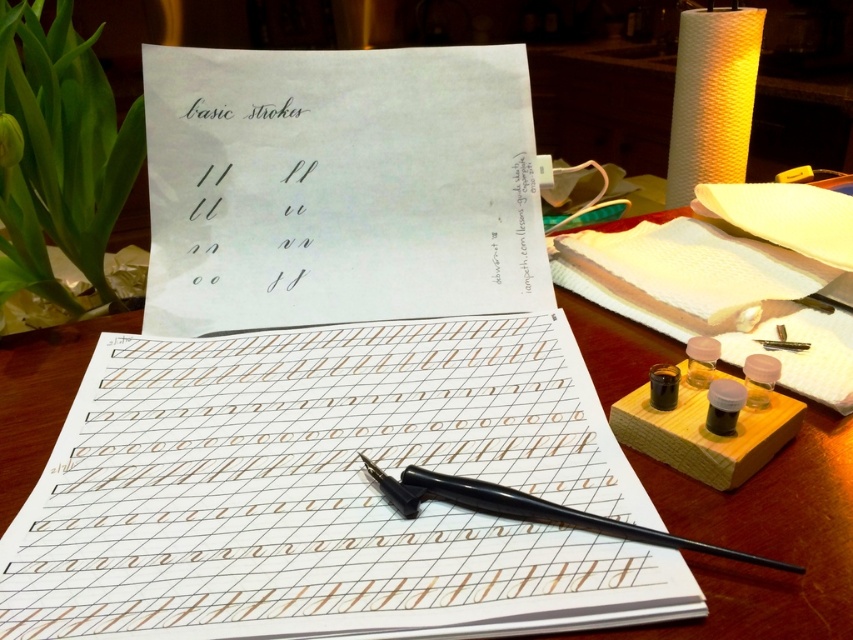
Does black smooth pen at center have a greater width compared to translucent amber glass inkwell at center right?

Yes, black smooth pen at center is wider than translucent amber glass inkwell at center right.

Find the location of a particular element. This screenshot has height=640, width=853. black smooth pen at center is located at coordinates (558, 513).

The image size is (853, 640). In order to click on black smooth pen at center in this screenshot , I will do `click(558, 513)`.

How distant is matte yellow paper at upper right from black metal pen at center?

The distance of matte yellow paper at upper right from black metal pen at center is 23.19 inches.

In the scene shown: Between matte yellow paper at upper right and black metal pen at center, which one is positioned lower?

black metal pen at center is lower down.

Looking at this image, who is more distant from viewer, (706, 108) or (404, 486)?

The point (706, 108) is more distant.

Locate an element on the screen. The height and width of the screenshot is (640, 853). matte yellow paper at upper right is located at coordinates (712, 97).

Who is more forward, (x=750, y=365) or (x=663, y=365)?

Positioned in front is point (x=750, y=365).

Is translucent plastic ink bottles at lower right in front of black glossy ink at lower right?

That is True.

Is point (770, 378) farther from viewer compared to point (664, 380)?

No, it is in front of (664, 380).

The height and width of the screenshot is (640, 853). I want to click on translucent plastic ink bottles at lower right, so click(759, 378).